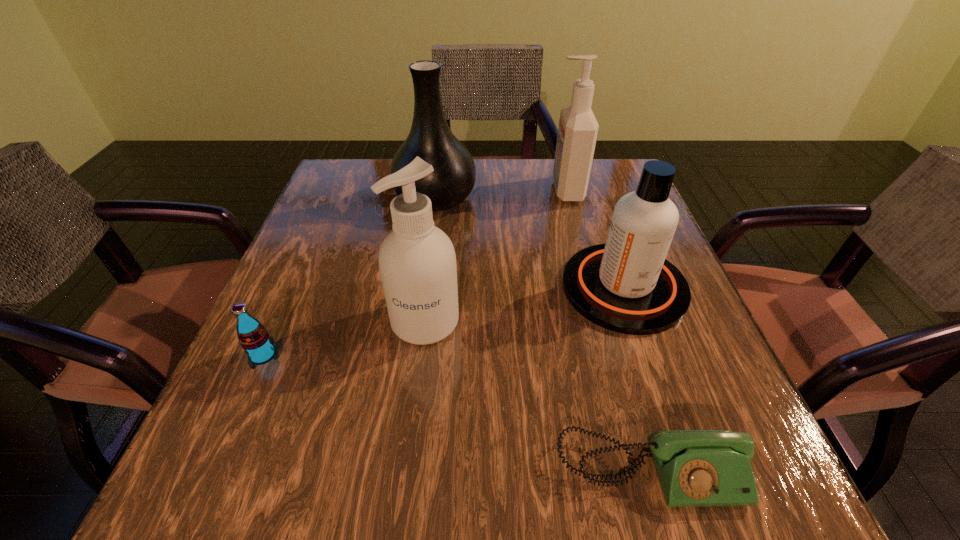
Locate an element on the screen. Image resolution: width=960 pixels, height=540 pixels. free space located on the front label of the farthest cleansing agent is located at coordinates (409, 190).

The width and height of the screenshot is (960, 540). I want to click on free spot located 0.170m on the right of the vase, so click(x=546, y=199).

I want to click on vacant area situated on the front label of the leftmost cleansing agent, so click(x=415, y=407).

Locate an element on the screen. The height and width of the screenshot is (540, 960). free region located on the left of the shortest cleansing agent is located at coordinates (468, 288).

At what (x,y) coordinates should I click in order to perform the action: click on free space located 0.140m on the front of the second shortest object. Please return your answer as a coordinate pair (x, y). Looking at the image, I should click on (219, 455).

Image resolution: width=960 pixels, height=540 pixels. In order to click on cleansing agent that is at the far edge in this screenshot , I will do `click(577, 133)`.

The width and height of the screenshot is (960, 540). Identify the location of vase present at the far edge. (430, 138).

Find the location of a particular element. object that is at the near edge is located at coordinates (696, 468).

You are a GUI agent. You are given a task and a screenshot of the screen. Output one action in this format:
    pyautogui.click(x=<x>, y=<y>)
    Task: Click on the object that is at the left edge
    This screenshot has width=960, height=540.
    Given the screenshot: What is the action you would take?
    pyautogui.click(x=253, y=337)

The width and height of the screenshot is (960, 540). In order to click on telephone located at the right edge in this screenshot , I will do `click(696, 468)`.